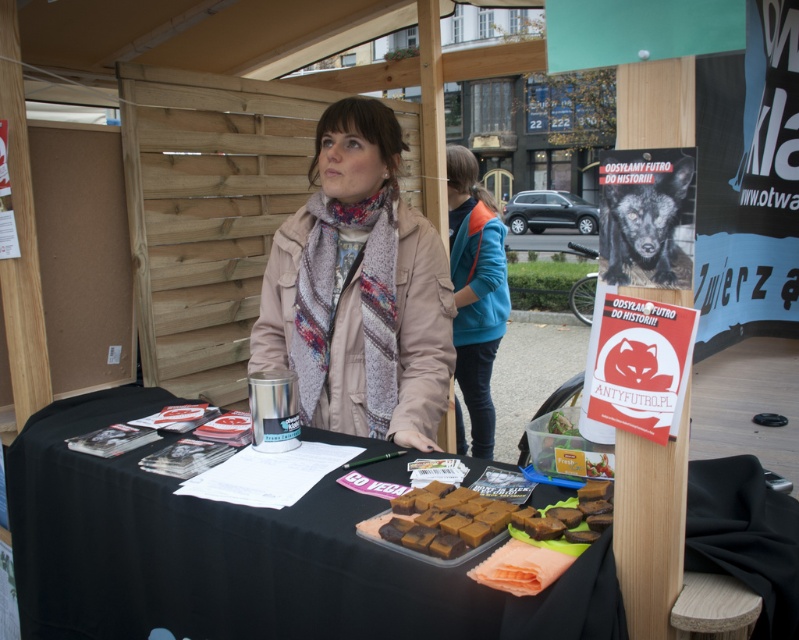
Question: Observing the image, what is the correct spatial positioning of black fabric table at center in reference to brown matte fudge at center?

Choices:
 (A) left
 (B) right

Answer: (A)

Question: Which point is farther to the camera?

Choices:
 (A) (583, 531)
 (B) (452, 515)
 (C) (189, 573)

Answer: (C)

Question: Is beige fabric coat at center thinner than brown matte fudge at lower center?

Choices:
 (A) no
 (B) yes

Answer: (A)

Question: Is black fabric table at center thinner than blue fabric jacket at center?

Choices:
 (A) no
 (B) yes

Answer: (A)

Question: Which of the following is the farthest from the observer?

Choices:
 (A) (439, 522)
 (B) (14, 509)

Answer: (B)

Question: Which object is positioned farthest from the brown matte fudge at lower center?

Choices:
 (A) brown matte fudge at center
 (B) beige fabric coat at center
 (C) blue fabric jacket at center

Answer: (C)